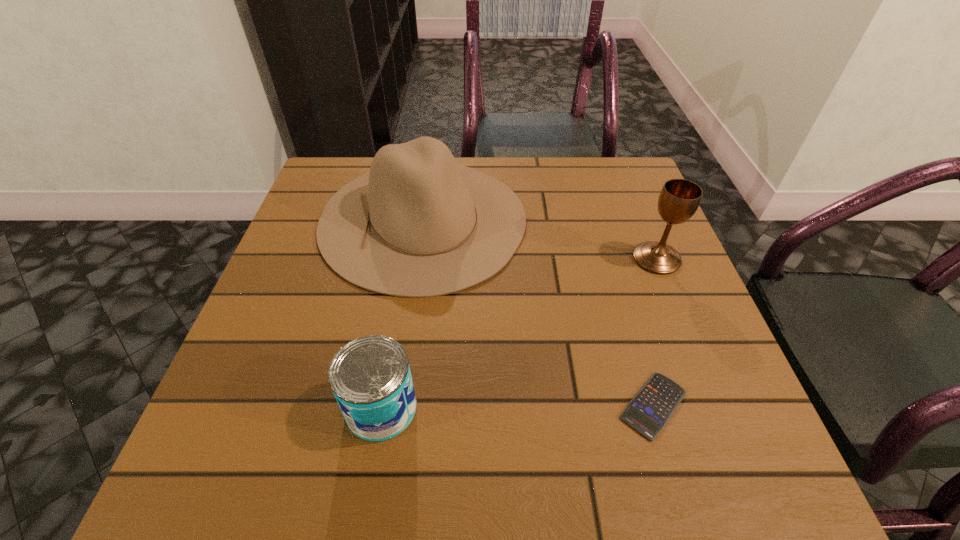
Where is `sombrero`? The image size is (960, 540). sombrero is located at coordinates (418, 224).

Where is `chalice`? The width and height of the screenshot is (960, 540). chalice is located at coordinates (679, 199).

Identify the location of the second shortest object. coord(370,377).

The width and height of the screenshot is (960, 540). I want to click on the shortest object, so click(651, 408).

Locate an element on the screen. free spot located 0.120m on the front of the sombrero is located at coordinates pos(405,349).

Locate an element on the screen. The width and height of the screenshot is (960, 540). vacant space located 0.260m on the left of the chalice is located at coordinates (512, 259).

At what (x,y) coordinates should I click in order to perform the action: click on free region located on the back of the second shortest object. Please return your answer as a coordinate pair (x, y). The width and height of the screenshot is (960, 540). Looking at the image, I should click on (407, 255).

Where is `free spot located 0.200m on the back of the calculator`? This screenshot has height=540, width=960. free spot located 0.200m on the back of the calculator is located at coordinates (618, 287).

Where is `object that is at the far edge`? Image resolution: width=960 pixels, height=540 pixels. object that is at the far edge is located at coordinates (418, 224).

Locate an element on the screen. This screenshot has height=540, width=960. can that is at the near edge is located at coordinates (370, 377).